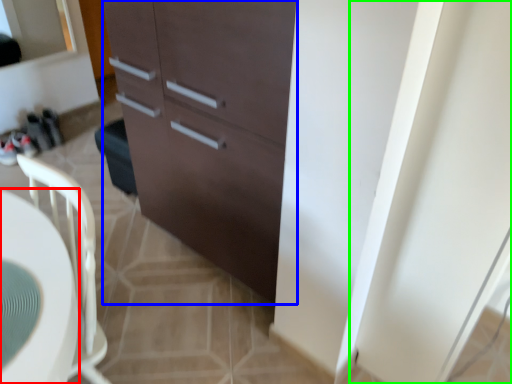
Question: Considering the real-world distances, which object is closest to desk (highlighted by a red box)? cabinetry (highlighted by a blue box) or screen door (highlighted by a green box).

Choices:
 (A) cabinetry
 (B) screen door

Answer: (A)